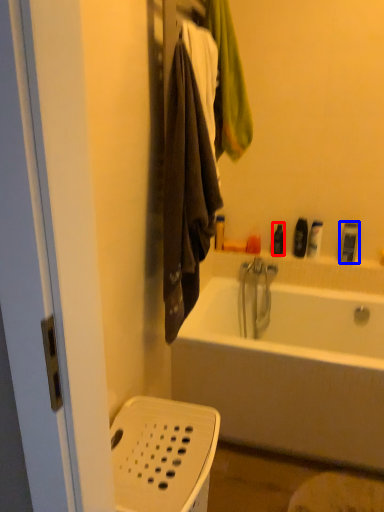
Question: Which object is closer to the camera taking this photo, toiletry (highlighted by a red box) or toiletry (highlighted by a blue box)?

Choices:
 (A) toiletry
 (B) toiletry

Answer: (B)